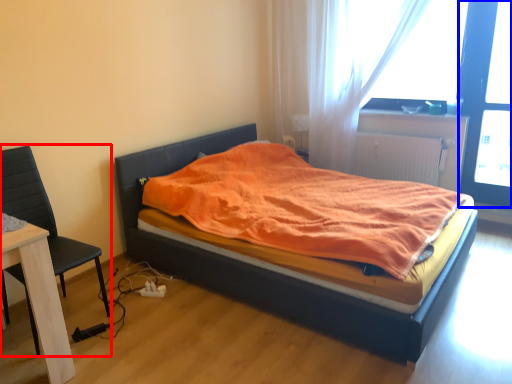
Question: Which object is further to the camera taking this photo, chair (highlighted by a red box) or screen door (highlighted by a blue box)?

Choices:
 (A) chair
 (B) screen door

Answer: (B)